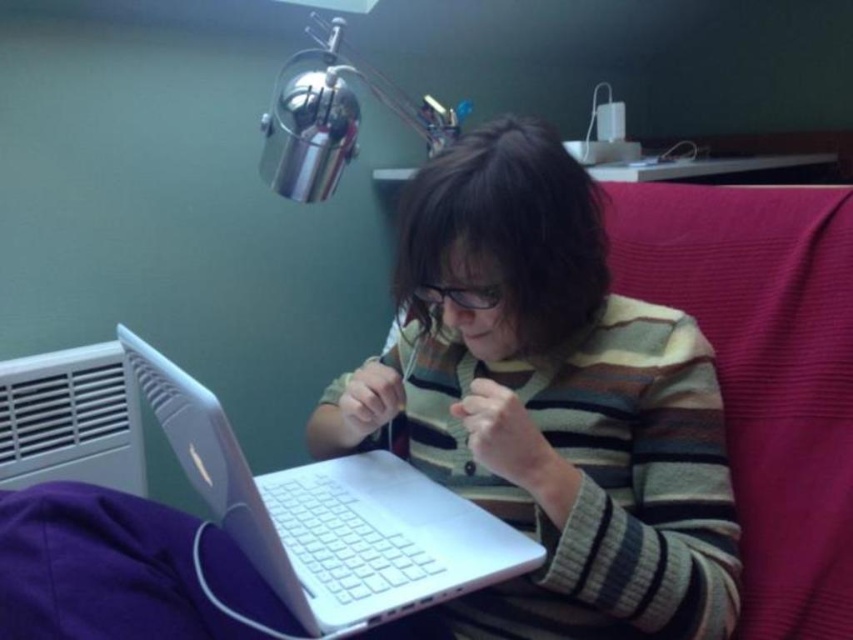
Question: Which point is farther to the camera?

Choices:
 (A) brushed metal lamp at upper center
 (B) striped sweater at center
 (C) white plastic laptop at center

Answer: (A)

Question: Can you confirm if white plastic laptop at center is thinner than brushed metal lamp at upper center?

Choices:
 (A) no
 (B) yes

Answer: (B)

Question: Which of the following is the farthest from the observer?

Choices:
 (A) striped sweater at center
 (B) brushed metal lamp at upper center
 (C) white plastic laptop at center

Answer: (B)

Question: Can you confirm if striped sweater at center is positioned to the left of brushed metal lamp at upper center?

Choices:
 (A) no
 (B) yes

Answer: (A)

Question: Among these objects, which one is farthest from the camera?

Choices:
 (A) brushed metal lamp at upper center
 (B) white plastic laptop at center
 (C) striped sweater at center

Answer: (A)

Question: Is striped sweater at center smaller than brushed metal lamp at upper center?

Choices:
 (A) no
 (B) yes

Answer: (B)